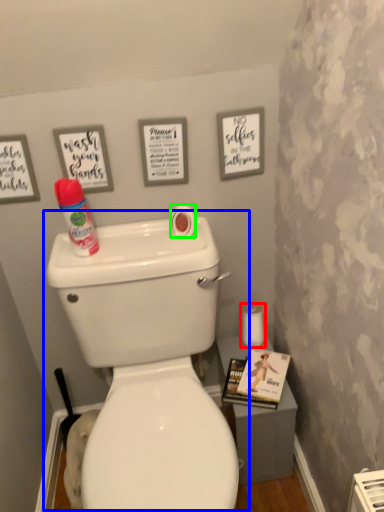
Question: Estimate the real-world distances between objects in this image. Which object is farther from toilet paper (highlighted by a red box), toilet (highlighted by a blue box) or toilet paper (highlighted by a green box)?

Choices:
 (A) toilet
 (B) toilet paper

Answer: (A)